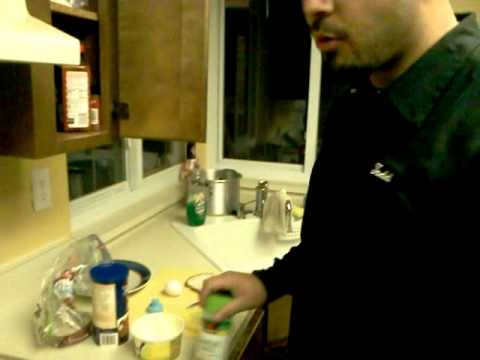
Identify the location of cabinet. The image size is (480, 360). (150, 76), (50, 109).